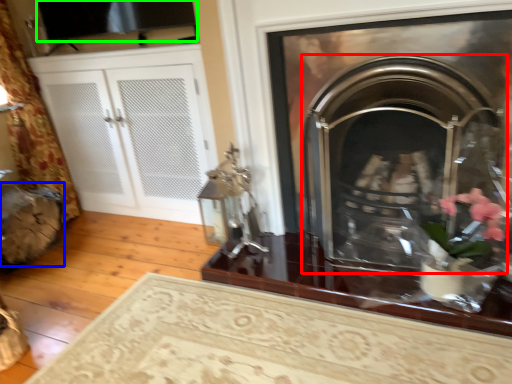
Question: Which object is positioned closest to fireplace (highlighted by a red box)? Select from chair (highlighted by a blue box) and window screen (highlighted by a green box).

Choices:
 (A) chair
 (B) window screen

Answer: (B)